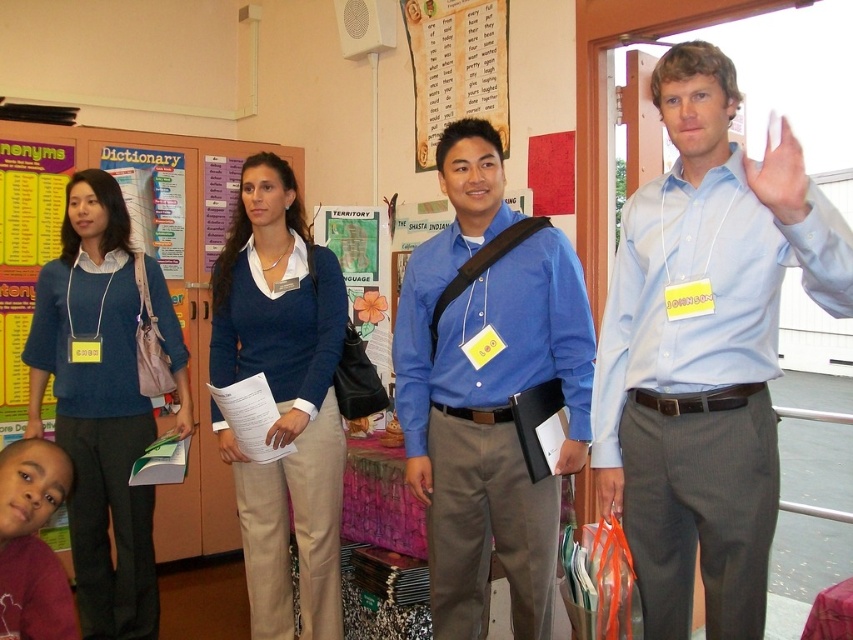
Is white paper at center further to camera compared to matte blue shirt at center?

Yes.

Is point (286, 432) behind point (422, 456)?

Yes.

You are a GUI agent. You are given a task and a screenshot of the screen. Output one action in this format:
    pyautogui.click(x=<x>, y=<y>)
    Task: Click on the white paper at center
    The width and height of the screenshot is (853, 640).
    Given the screenshot: What is the action you would take?
    pyautogui.click(x=286, y=428)

Who is shorter, red cotton shirt at lower left or pink matte paper at lower left?

pink matte paper at lower left is shorter.

Which is below, red cotton shirt at lower left or pink matte paper at lower left?

red cotton shirt at lower left is below.

Locate an element on the screen. The image size is (853, 640). red cotton shirt at lower left is located at coordinates (32, 544).

Is white matte hand at upper right in front of white paper at center?

Yes.

Is point (772, 150) positioned behind point (289, 417)?

That is False.

The width and height of the screenshot is (853, 640). In order to click on white matte hand at upper right in this screenshot , I will do tap(780, 173).